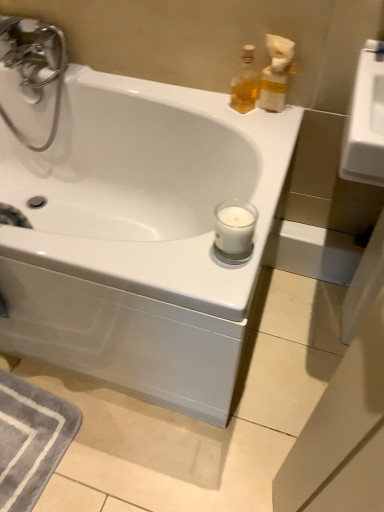
Question: Considering the relative sizes of translucent glass bottle at upper right, the first soap dispenser in the left-to-right sequence, and white glossy bathtub at center in the image provided, is translucent glass bottle at upper right, the first soap dispenser in the left-to-right sequence, taller than white glossy bathtub at center?

Choices:
 (A) no
 (B) yes

Answer: (A)

Question: Is translucent glass bottle at upper right, placed as the 2th soap dispenser when sorted from right to left, smaller than white glossy bathtub at center?

Choices:
 (A) no
 (B) yes

Answer: (B)

Question: Is translucent glass bottle at upper right, placed as the 2th soap dispenser when sorted from right to left, not within white glossy bathtub at center?

Choices:
 (A) yes
 (B) no

Answer: (A)

Question: Is translucent glass bottle at upper right, the first soap dispenser in the left-to-right sequence, next to white glossy bathtub at center and touching it?

Choices:
 (A) no
 (B) yes

Answer: (A)

Question: From a real-world perspective, does translucent glass bottle at upper right, the first soap dispenser in the left-to-right sequence, stand above white glossy bathtub at center?

Choices:
 (A) yes
 (B) no

Answer: (A)

Question: Is translucent glass bottle at upper right, placed as the 2th soap dispenser when sorted from right to left, closer to camera compared to white glossy bathtub at center?

Choices:
 (A) yes
 (B) no

Answer: (B)

Question: Is translucent plastic soap dispenser at upper right, the 1th soap dispenser when ordered from right to left, shorter than translucent glass bottle at upper right, the first soap dispenser in the left-to-right sequence?

Choices:
 (A) yes
 (B) no

Answer: (B)

Question: Considering the relative sizes of translucent plastic soap dispenser at upper right, acting as the 2th soap dispenser starting from the left, and translucent glass bottle at upper right, the first soap dispenser in the left-to-right sequence, in the image provided, is translucent plastic soap dispenser at upper right, acting as the 2th soap dispenser starting from the left, bigger than translucent glass bottle at upper right, the first soap dispenser in the left-to-right sequence,?

Choices:
 (A) no
 (B) yes

Answer: (B)

Question: From a real-world perspective, is translucent plastic soap dispenser at upper right, acting as the 2th soap dispenser starting from the left, located beneath translucent glass bottle at upper right, placed as the 2th soap dispenser when sorted from right to left?

Choices:
 (A) yes
 (B) no

Answer: (B)

Question: Can you confirm if translucent plastic soap dispenser at upper right, the 1th soap dispenser when ordered from right to left, is positioned to the right of translucent glass bottle at upper right, placed as the 2th soap dispenser when sorted from right to left?

Choices:
 (A) yes
 (B) no

Answer: (A)

Question: Is translucent plastic soap dispenser at upper right, the 1th soap dispenser when ordered from right to left, not within translucent glass bottle at upper right, placed as the 2th soap dispenser when sorted from right to left?

Choices:
 (A) no
 (B) yes

Answer: (B)

Question: Is translucent plastic soap dispenser at upper right, the 1th soap dispenser when ordered from right to left, next to translucent glass bottle at upper right, placed as the 2th soap dispenser when sorted from right to left?

Choices:
 (A) no
 (B) yes

Answer: (B)

Question: From a real-world perspective, is white glossy bathtub at center physically below translucent plastic soap dispenser at upper right, the 1th soap dispenser when ordered from right to left?

Choices:
 (A) yes
 (B) no

Answer: (A)